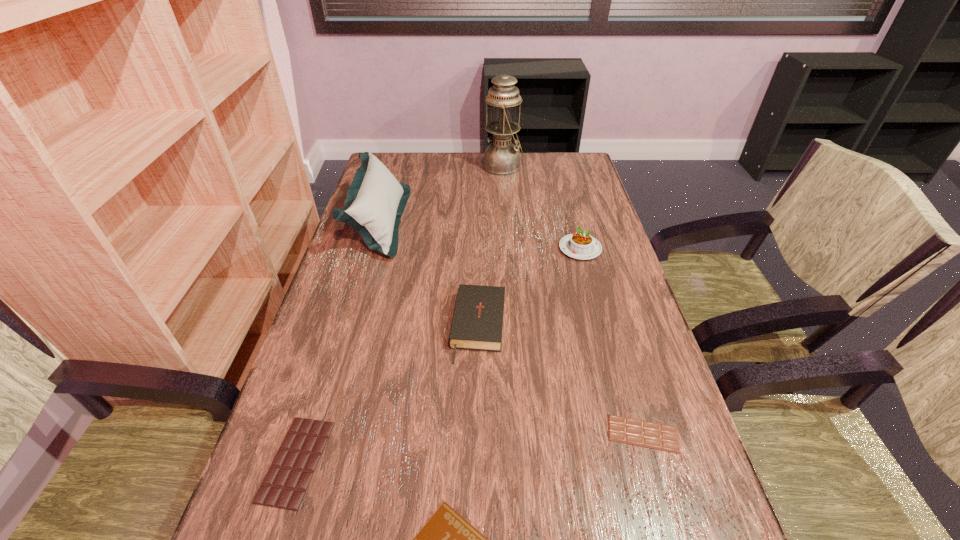
What are the coordinates of `vacant point located between the oil lamp and the tallest chocolate bar` in the screenshot? It's located at (399, 314).

You are a GUI agent. You are given a task and a screenshot of the screen. Output one action in this format:
    pyautogui.click(x=<x>, y=<y>)
    Task: Click on the vacant area that lies between the rightmost chocolate bar and the pudding
    This screenshot has width=960, height=540.
    Given the screenshot: What is the action you would take?
    pyautogui.click(x=612, y=341)

Image resolution: width=960 pixels, height=540 pixels. Identify the location of vacant region between the rightmost chocolate bar and the Bible. (561, 380).

This screenshot has width=960, height=540. What are the coordinates of `vacant area that lies between the rightmost chocolate bar and the fourth shortest object` in the screenshot? It's located at (561, 380).

Find the location of a particular element. This screenshot has height=540, width=960. object that can be found as the second closest to the second shortest chocolate bar is located at coordinates (477, 324).

Find the location of a particular element. The width and height of the screenshot is (960, 540). object that stands as the closest to the cushion is located at coordinates (477, 324).

The height and width of the screenshot is (540, 960). In order to click on the closest chocolate bar relative to the sixth tallest object in this screenshot , I will do `click(447, 539)`.

This screenshot has height=540, width=960. In order to click on chocolate bar identified as the second closest to the rightmost chocolate bar in this screenshot , I will do `click(285, 484)`.

This screenshot has height=540, width=960. Identify the location of blank area in the image that satisfies the following two spatial constraints: 1. on the surface of the rightmost chocolate bar; 2. on the left side of the cushion. (317, 434).

Locate an element on the screen. The height and width of the screenshot is (540, 960). free spot that satisfies the following two spatial constraints: 1. on the surface of the cushion; 2. on the left side of the third tallest object is located at coordinates (372, 248).